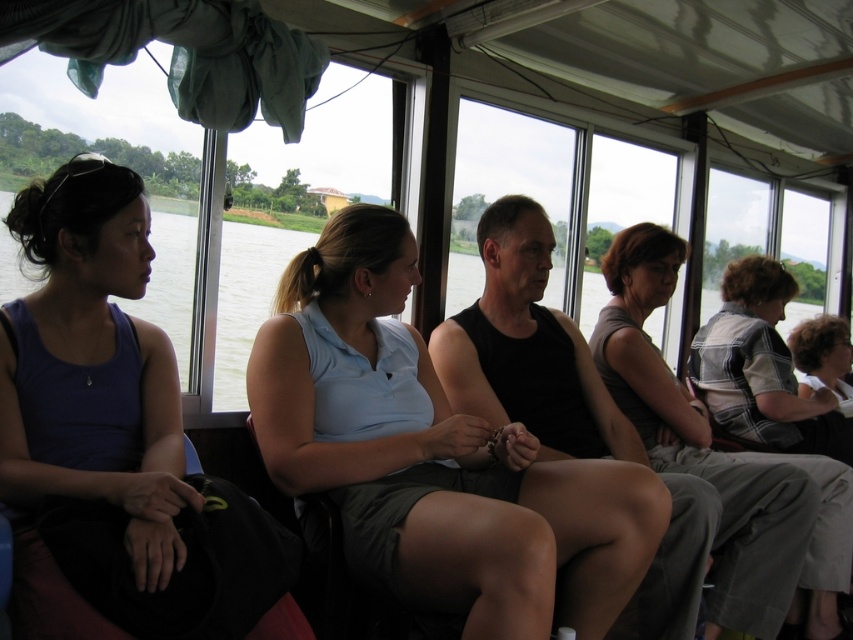
Question: Which of these objects is positioned closest to the gray fabric skirt at center?

Choices:
 (A) matte purple tank top at left
 (B) light blue fabric shirt at center
 (C) denim jacket at right

Answer: (C)

Question: Observing the image, what is the correct spatial positioning of matte purple tank top at left in reference to gray fabric skirt at center?

Choices:
 (A) right
 (B) left

Answer: (B)

Question: Which point is farther to the camera?

Choices:
 (A) light blue fabric shirt at center
 (B) denim jacket at right

Answer: (B)

Question: Can you confirm if gray fabric skirt at center is thinner than denim jacket at right?

Choices:
 (A) no
 (B) yes

Answer: (A)

Question: Considering the relative positions of light blue fabric shirt at center and denim jacket at right in the image provided, where is light blue fabric shirt at center located with respect to denim jacket at right?

Choices:
 (A) above
 (B) below

Answer: (B)

Question: Which object is positioned closest to the light blue fabric shirt at center?

Choices:
 (A) gray fabric skirt at center
 (B) denim jacket at right

Answer: (A)